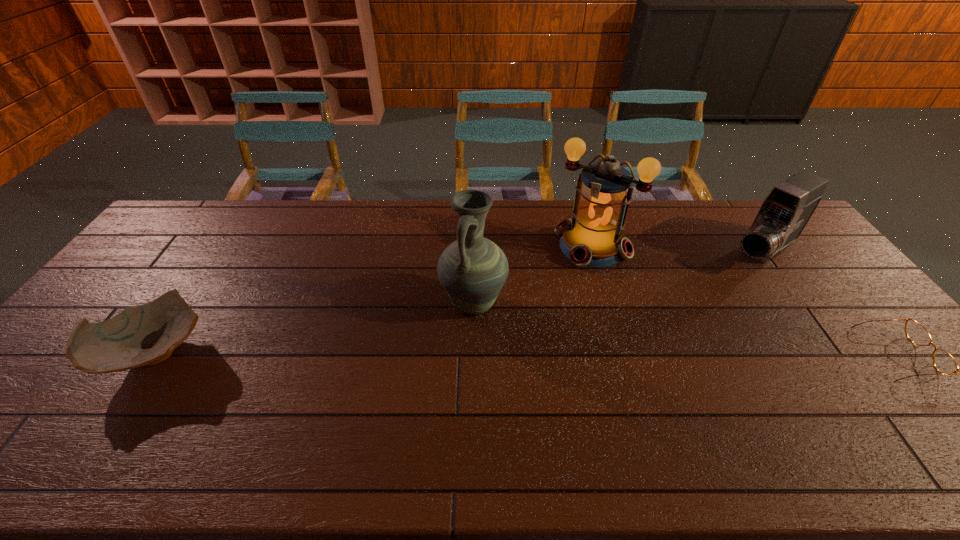
This screenshot has height=540, width=960. Identify the location of the fourth tallest object. (144, 335).

Identify the location of the leftmost object. This screenshot has height=540, width=960. (144, 335).

Image resolution: width=960 pixels, height=540 pixels. What are the coordinates of `spectacles` in the screenshot? It's located at (943, 362).

Locate an element on the screen. lantern is located at coordinates (593, 237).

This screenshot has width=960, height=540. I want to click on the third shortest object, so click(x=783, y=215).

Locate an element on the screen. the second object from left to right is located at coordinates (473, 269).

Where is `free space located 0.260m on the right of the leftmost object`? free space located 0.260m on the right of the leftmost object is located at coordinates pyautogui.click(x=309, y=352).

Find the location of a particular element. free region located 0.350m on the front-facing side of the lantern is located at coordinates click(521, 338).

Find the location of a particular element. This screenshot has width=960, height=540. vacant space located on the front-facing side of the lantern is located at coordinates (527, 330).

Find the location of `free location located 0.080m on the front-facing side of the lantern`. free location located 0.080m on the front-facing side of the lantern is located at coordinates (565, 280).